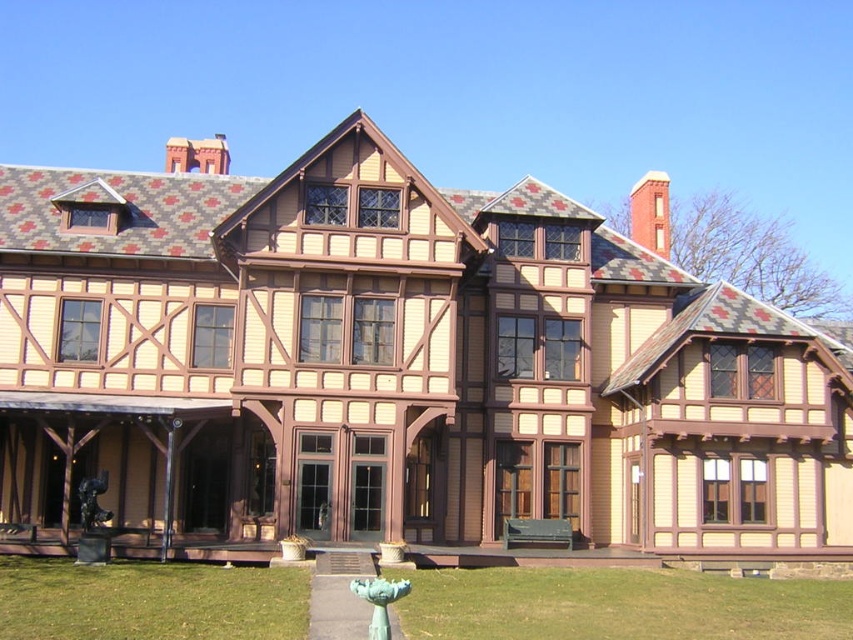
You are a photographer standing at the camera position in front of the grand building. You want to capture a photo that includes both the green grass at lower left and the front door. Since the grass is further away, will you need to adjust your camera angle to include both in the frame?

The green grass at lower left is 26.51 meters away from camera. Since the front door is much closer, you will need to adjust your camera angle to ensure both the green grass at lower left and the front door are within the frame.